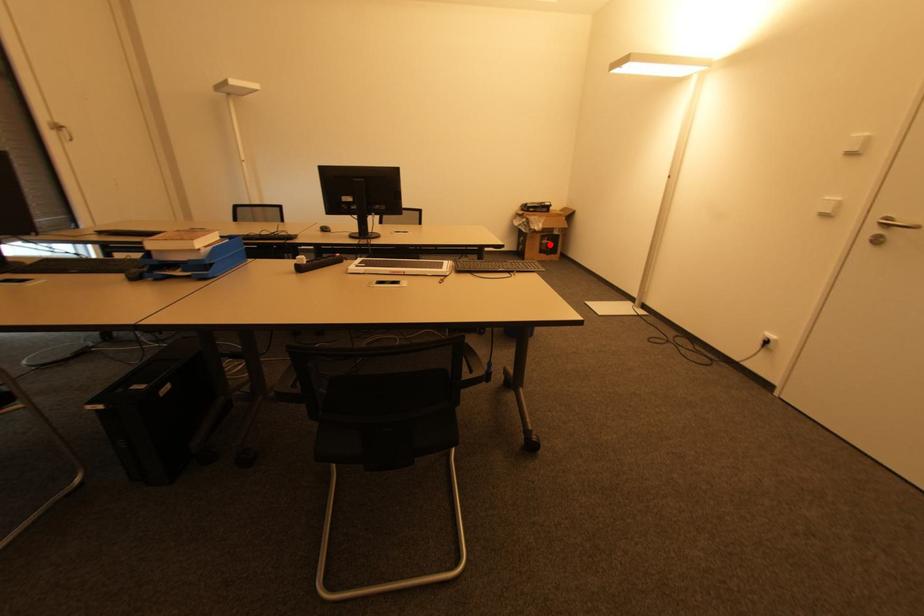
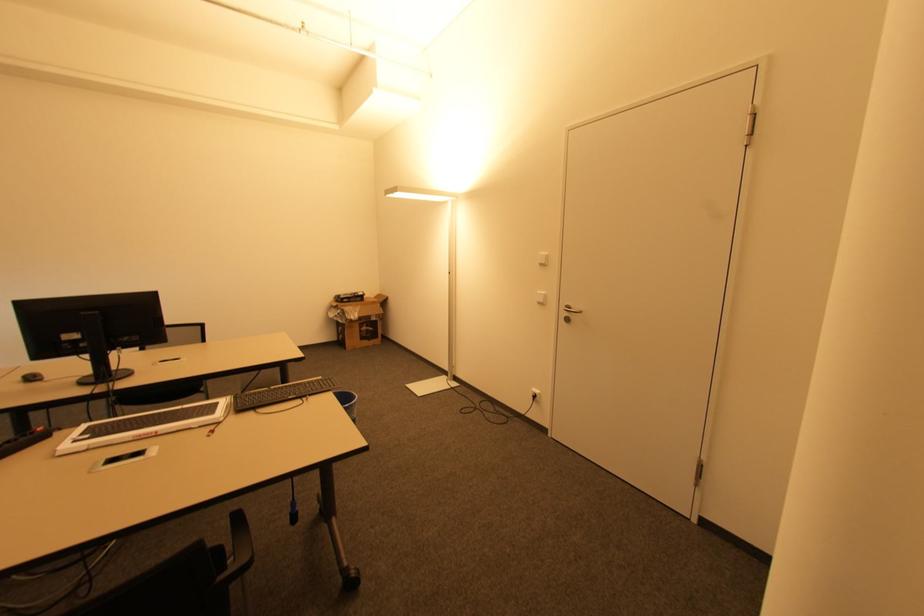
The point at the highlighted location is marked in the first image. Where is the corresponding point in the second image?

(369, 331)